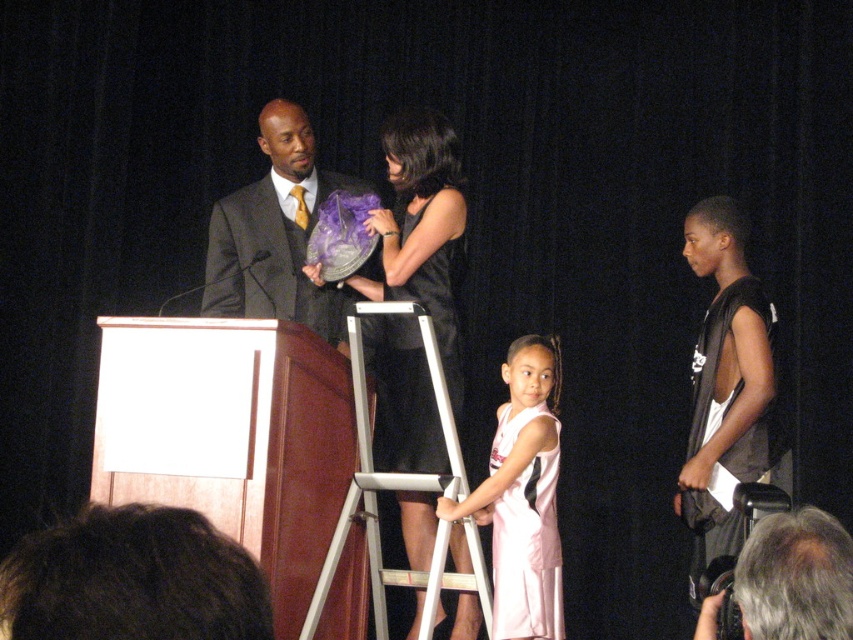
Question: Among these objects, which one is nearest to the camera?

Choices:
 (A) white jersey at center
 (B) gray hair at lower right
 (C) dark brown hair at lower left

Answer: (C)

Question: Is matte black suit at center smaller than black satin dress at center?

Choices:
 (A) no
 (B) yes

Answer: (A)

Question: Which of the following is the farthest from the observer?

Choices:
 (A) (692, 572)
 (B) (263, 292)
 (C) (177, 531)

Answer: (B)

Question: Does dark brown hair at lower left appear on the right side of silver metallic ladder at center?

Choices:
 (A) no
 (B) yes

Answer: (A)

Question: Is dark brown hair at lower left further to the viewer compared to matte black suit at center?

Choices:
 (A) no
 (B) yes

Answer: (A)

Question: Estimate the real-world distances between objects in this image. Which object is closer to the gray hair at lower right?

Choices:
 (A) dark brown hair at lower left
 (B) silver metallic ladder at center
 (C) black satin dress at center
 (D) pink satin dress at center

Answer: (A)